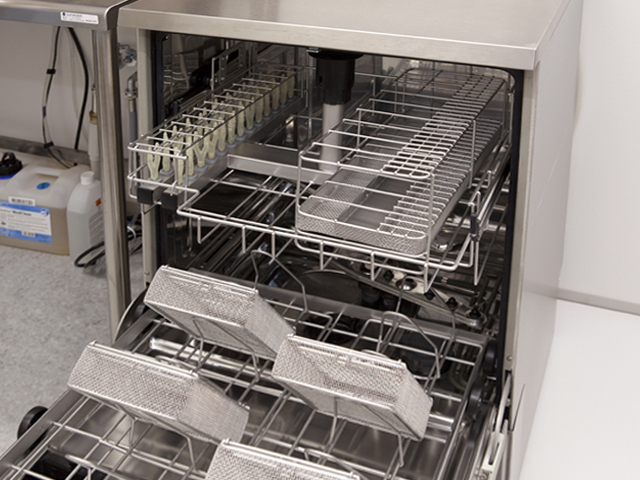
Identify the location of table leg. (99, 176).